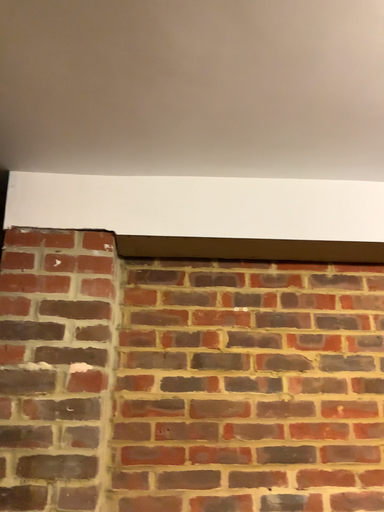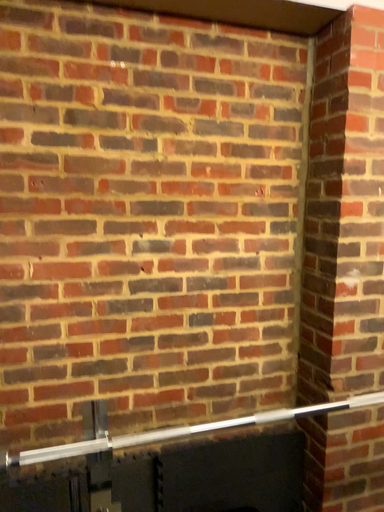
Question: How did the camera likely rotate when shooting the video?

Choices:
 (A) rotated right
 (B) rotated left

Answer: (A)